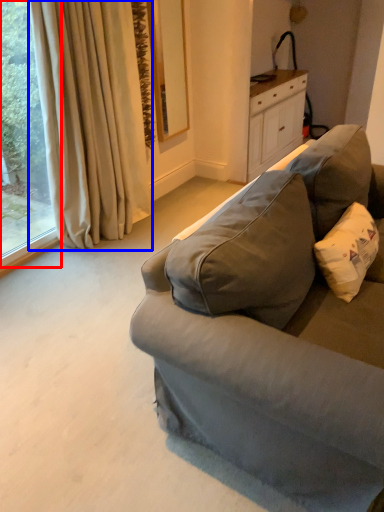
Question: Which point is closer to the camera, window (highlighted by a red box) or curtain (highlighted by a blue box)?

Choices:
 (A) window
 (B) curtain

Answer: (A)